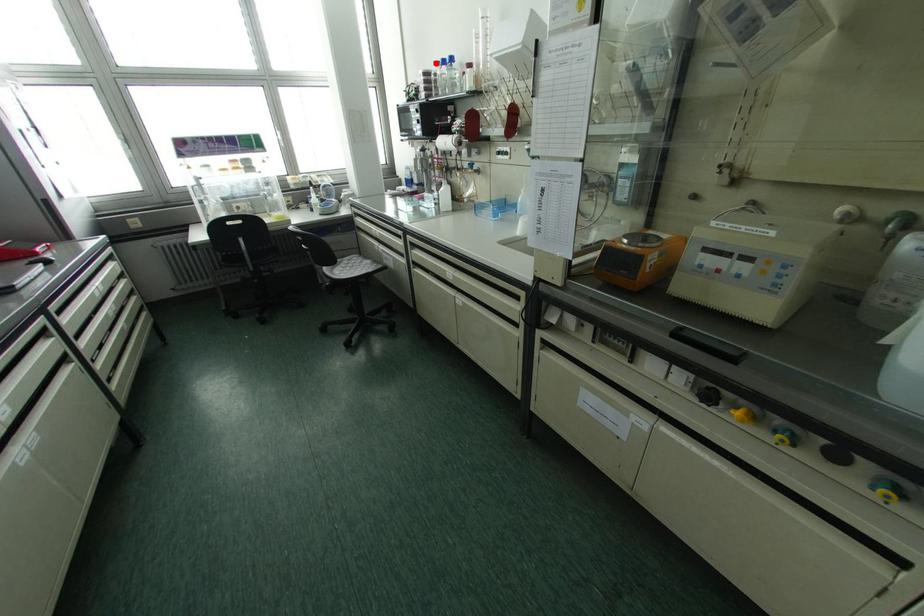
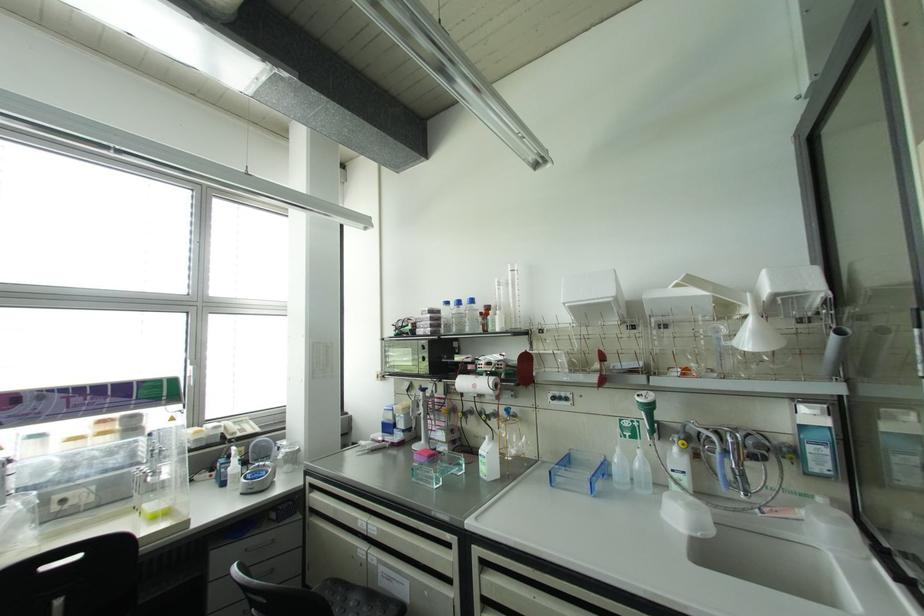
Where in the second image is the point corresponding to the highlighted location from the first image?

(446, 302)